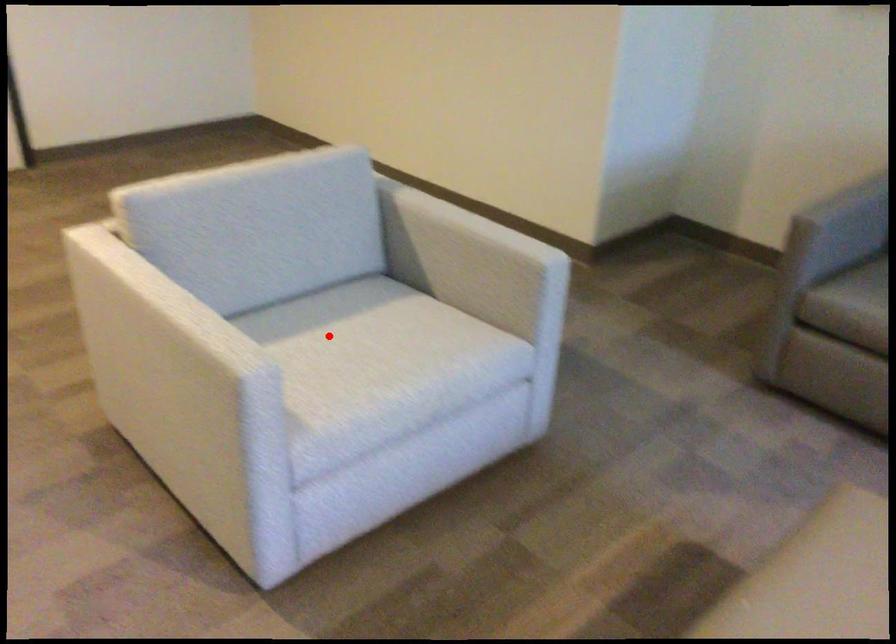
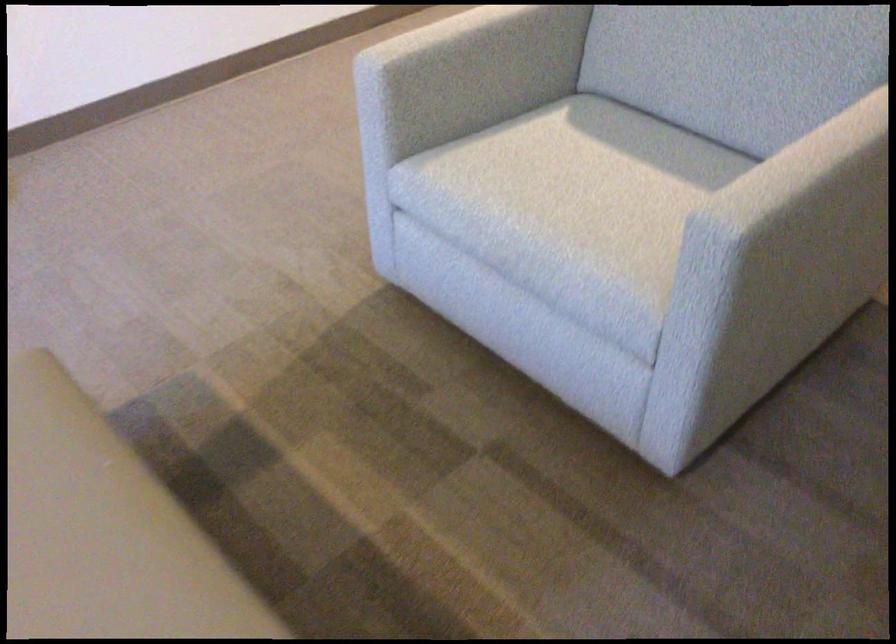
The point at the highlighted location is marked in the first image. Where is the corresponding point in the second image?

(607, 169)